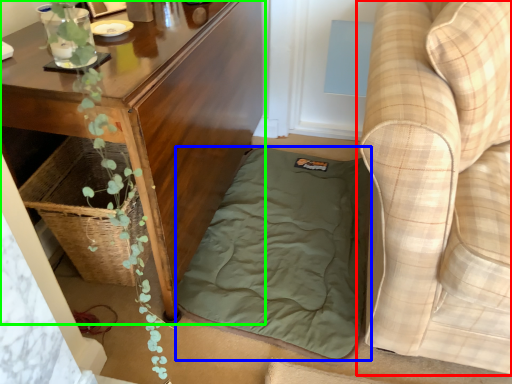
Question: Estimate the real-world distances between objects in this image. Which object is farther from studio couch (highlighted by a red box), mattress (highlighted by a blue box) or table (highlighted by a green box)?

Choices:
 (A) mattress
 (B) table

Answer: (B)